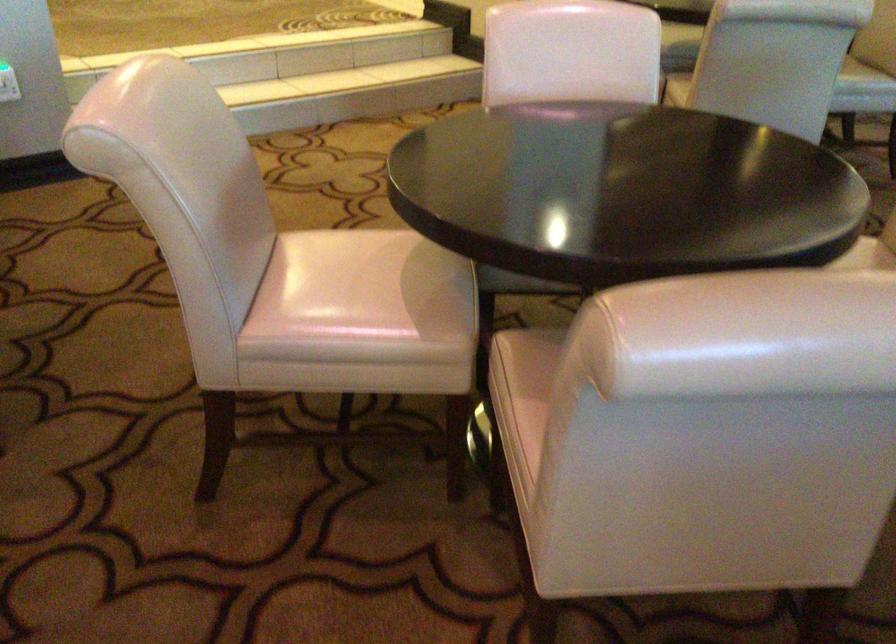
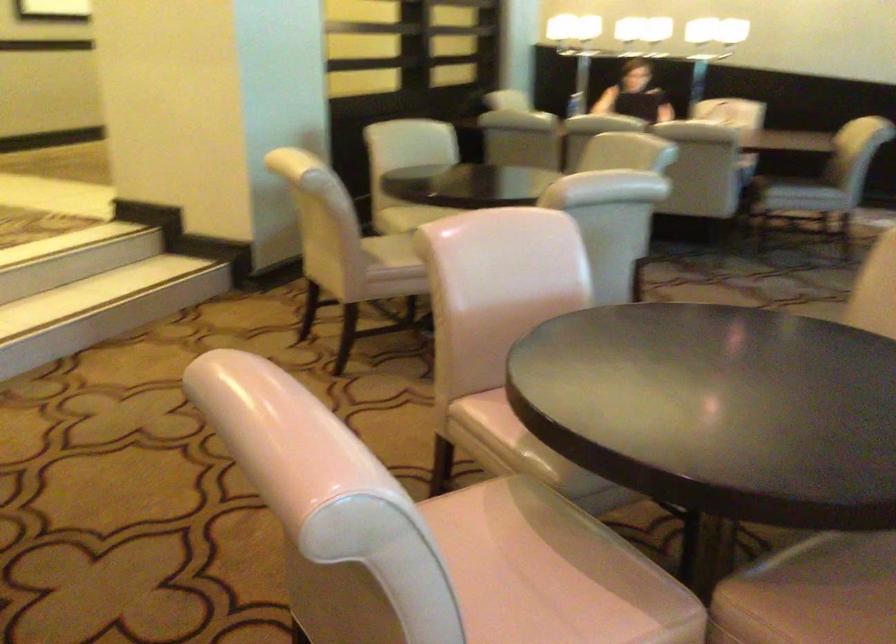
Locate, in the second image, the point that corresponds to (x=350, y=290) in the first image.

(520, 587)